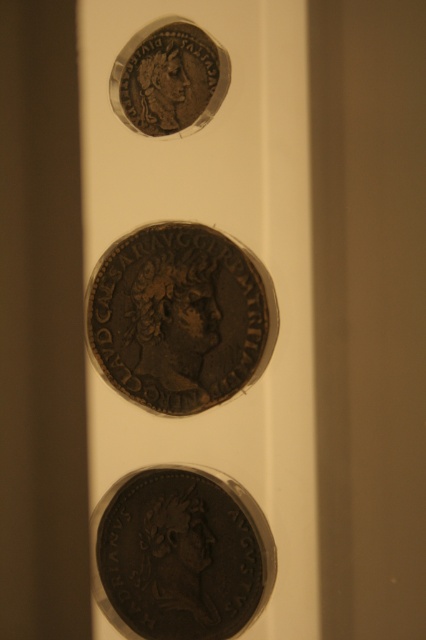
You are a museum curator arranging an exhibit. You have two coins to place on a display panel. The dark brown metal coin at center and the bronze coin at upper center. According to the image, which coin should be placed to the left of the other to maintain the original arrangement?

The dark brown metal coin at center is positioned on the right side of bronze coin at upper center, so to maintain the original arrangement, the bronze coin at upper center should be placed to the left of the dark brown metal coin at center.

You are a museum curator who needs to ensure the spacing between the coins meets the safety guidelines. The required minimum distance between any two coins is 6 feet. Based on the image, is the spacing between the point at (172, 285) and the other coins sufficient?

The spacing between the point at (172, 285) and the other coins is 5.59 feet, which is less than the required 6 feet. Therefore, the spacing does not meet the safety guidelines.

You are a historian examining the coins displayed in the image. You need to locate the dark brown metallic coin at center. Where exactly should you look?

You should look at point 0.423 on the vertical axis and 0.497 on the horizontal axis to find the dark brown metallic coin at center.